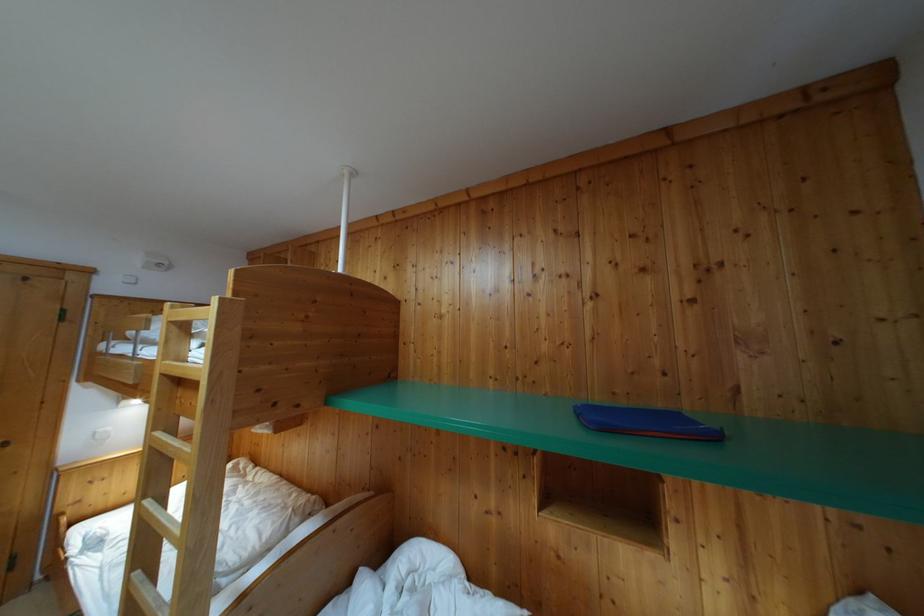
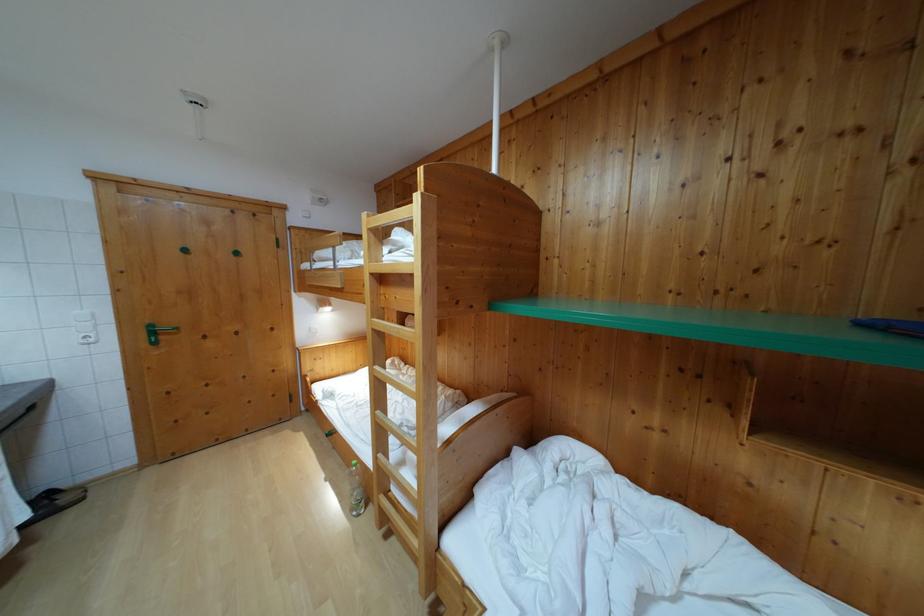
Locate, in the second image, the point that corresponds to point 176,314 in the first image.

(371, 223)